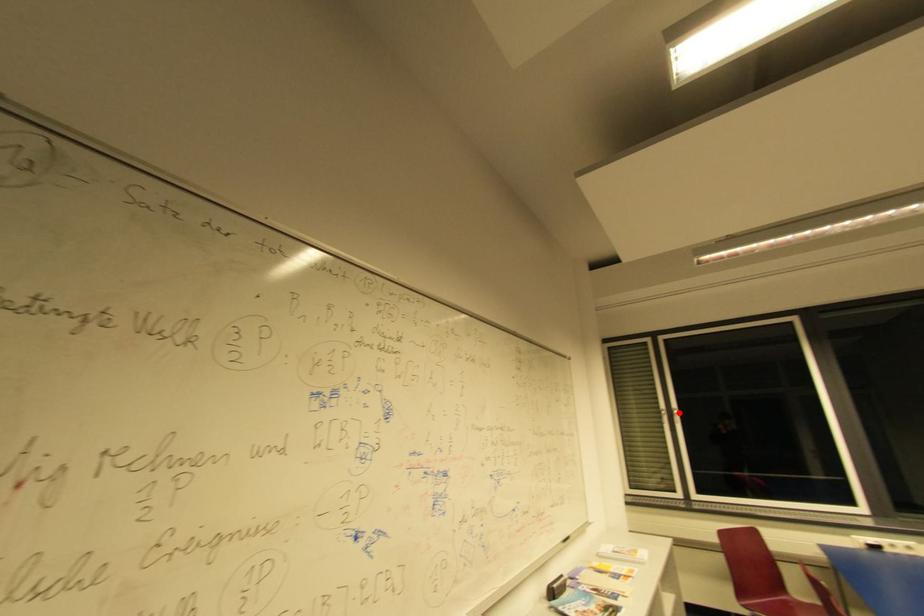
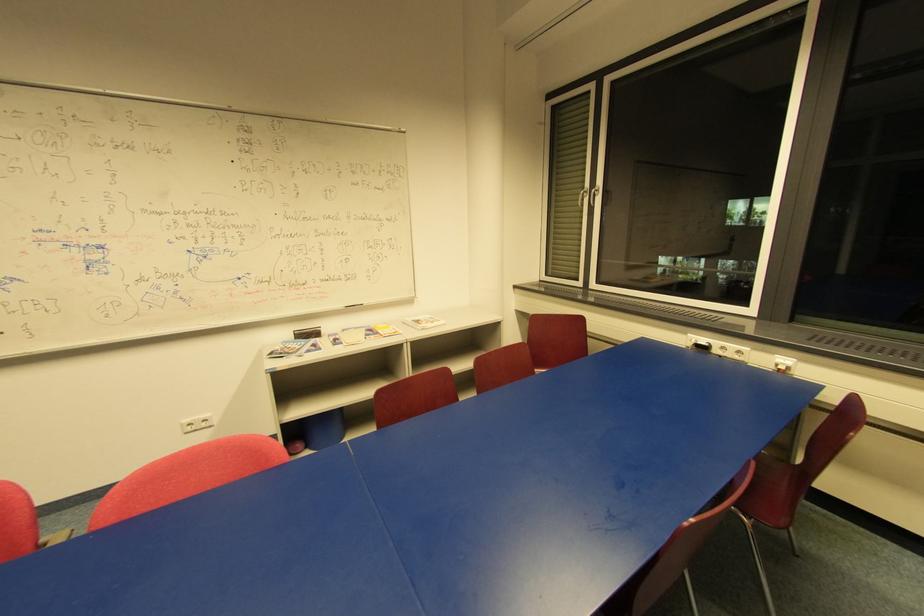
Question: I am providing you with two images of the same scene from different viewpoints. Given a red point in image1, look at the same physical point in image2. Is it:

Choices:
 (A) Closer to the viewpoint
 (B) Farther from the viewpoint

Answer: (A)